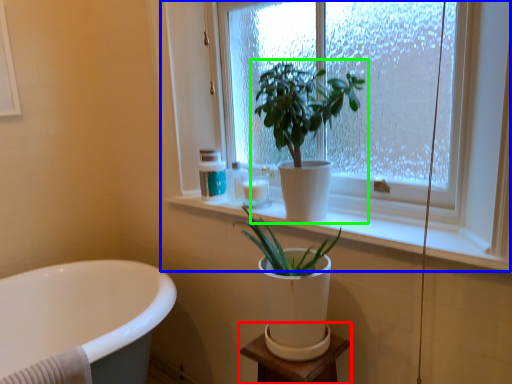
Question: Considering the real-world distances, which object is farthest from vanity (highlighted by a red box)? window (highlighted by a blue box) or houseplant (highlighted by a green box)?

Choices:
 (A) window
 (B) houseplant

Answer: (A)